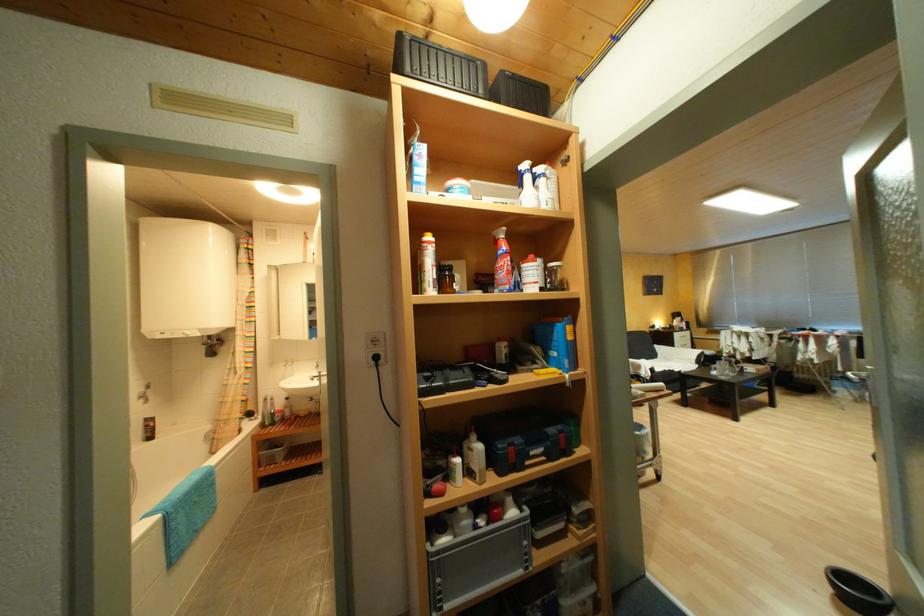
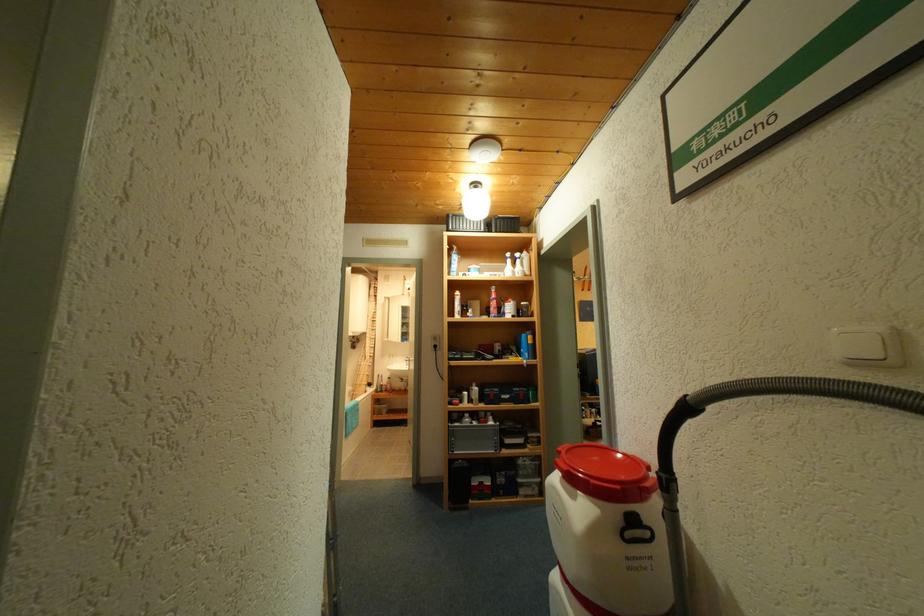
Locate, in the second image, the point that corresponds to (x=272, y=426) in the first image.

(385, 392)